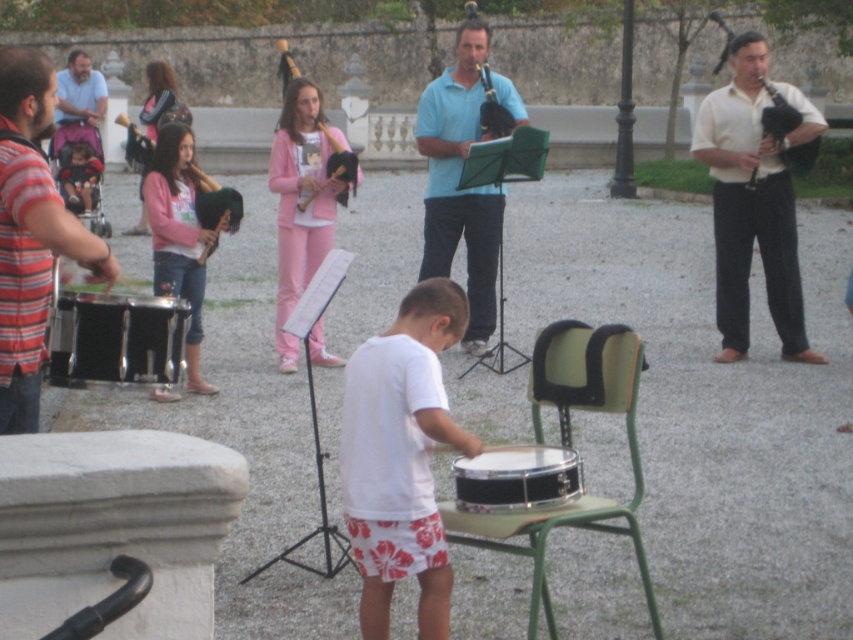
Question: Which point is farther to the camera?

Choices:
 (A) (540, 492)
 (B) (148, 214)

Answer: (B)

Question: Is white cotton shirt at center closer to camera compared to black drum at center?

Choices:
 (A) no
 (B) yes

Answer: (B)

Question: Which point is farther from the camera taking this photo?

Choices:
 (A) (578, 324)
 (B) (531, 508)

Answer: (A)

Question: Is light beige shirt at right to the right of pink fabric jacket at upper left from the viewer's perspective?

Choices:
 (A) no
 (B) yes

Answer: (B)

Question: Which point is closer to the camera?

Choices:
 (A) light beige shirt at right
 (B) black drum at left

Answer: (B)

Question: Can you confirm if light beige shirt at right is wider than black drum at center?

Choices:
 (A) yes
 (B) no

Answer: (A)